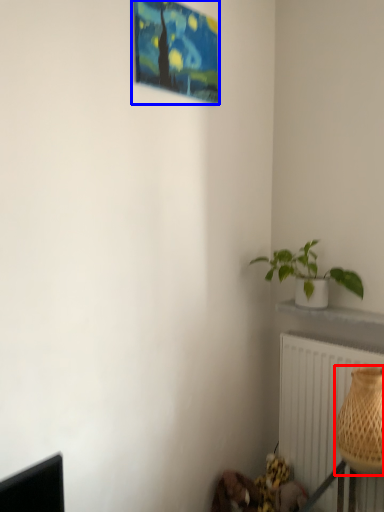
Question: Among these objects, which one is nearest to the camera, basket (highlighted by a red box) or picture frame (highlighted by a blue box)?

Choices:
 (A) basket
 (B) picture frame

Answer: (B)